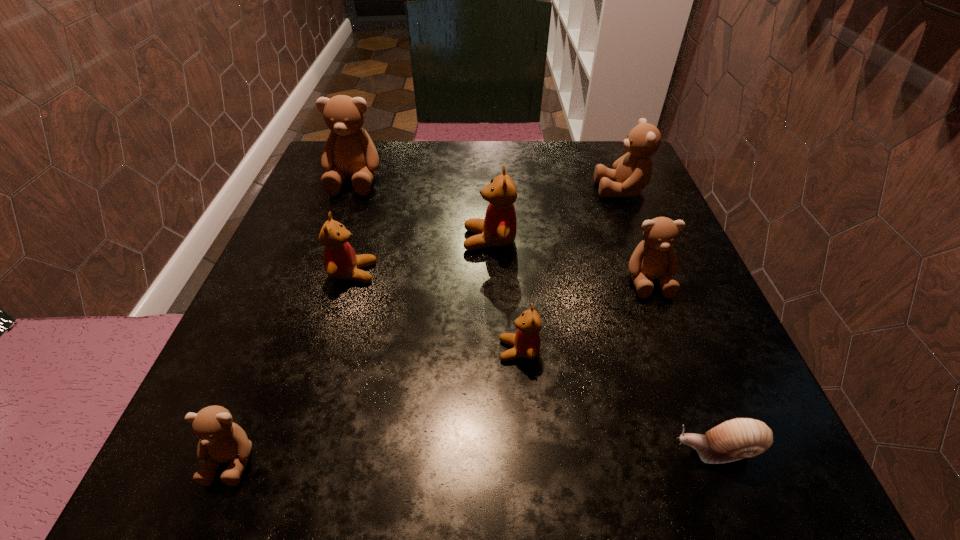
I want to click on the shortest object, so click(x=739, y=438).

Where is `vacant space located 0.330m on the front-facing side of the tallest teddy bear`? vacant space located 0.330m on the front-facing side of the tallest teddy bear is located at coordinates (305, 316).

This screenshot has height=540, width=960. What are the coordinates of `vacant space located on the front-facing side of the second biggest brown teddy bear` in the screenshot? It's located at (559, 190).

What are the coordinates of `free region located 0.230m on the front-facing side of the second biggest brown teddy bear` in the screenshot? It's located at (490, 190).

Locate an element on the screen. The height and width of the screenshot is (540, 960). vacant space situated 0.050m on the front-facing side of the second biggest brown teddy bear is located at coordinates (572, 190).

The height and width of the screenshot is (540, 960). In order to click on vacant area situated on the front-facing side of the biggest red teddy bear in this screenshot , I will do coord(412,240).

The image size is (960, 540). Find the location of `free space located on the front-facing side of the biggest red teddy bear`. free space located on the front-facing side of the biggest red teddy bear is located at coordinates [280, 240].

The image size is (960, 540). I want to click on free space located on the front-facing side of the biggest red teddy bear, so click(307, 240).

What are the coordinates of `vacant area situated on the front-facing side of the second smallest red teddy bear` in the screenshot? It's located at (574, 273).

At what (x,y) coordinates should I click in order to perform the action: click on vacant space situated on the front-facing side of the third biggest brown teddy bear. Please return your answer as a coordinate pair (x, y). This screenshot has height=540, width=960. Looking at the image, I should click on (714, 455).